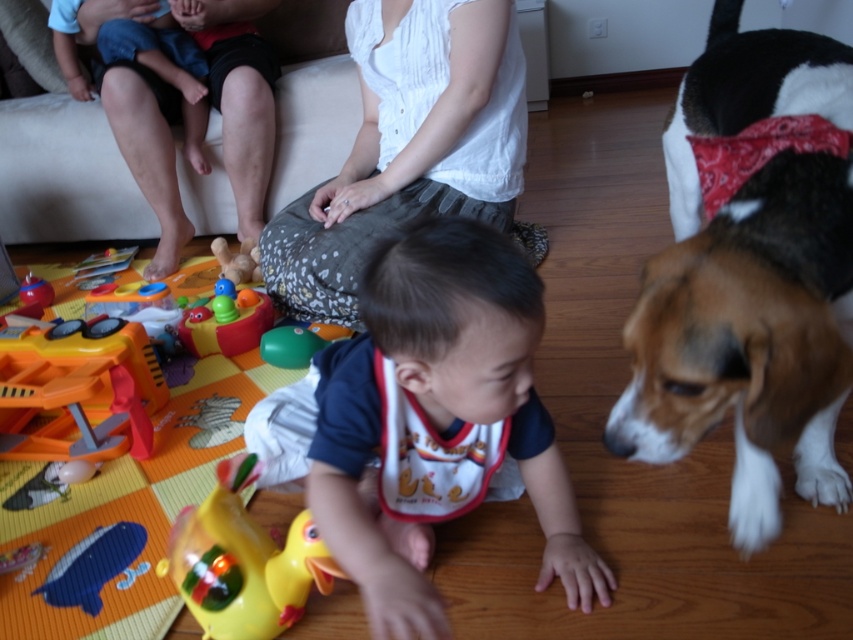
Can you confirm if yellow rubber duck at lower center is positioned above rubber/plastic toy at center?

Incorrect, yellow rubber duck at lower center is not positioned above rubber/plastic toy at center.

Is point (177, 563) farther from camera compared to point (206, 337)?

No, it is in front of (206, 337).

At what (x,y) coordinates should I click in order to perform the action: click on yellow rubber duck at lower center. Please return your answer as a coordinate pair (x, y). The image size is (853, 640). Looking at the image, I should click on (242, 561).

Can you confirm if yellow rubber duck at center is smaller than orange plastic toy at lower left?

Actually, yellow rubber duck at center might be larger than orange plastic toy at lower left.

In the scene shown: Who is positioned more to the left, yellow rubber duck at center or orange plastic toy at lower left?

orange plastic toy at lower left

Is point (585, 570) positioned in front of point (64, 442)?

Yes, it is in front of point (64, 442).

I want to click on yellow rubber duck at center, so click(x=438, y=419).

Which is below, white cotton shirt at upper center or rubber duck at center?

rubber duck at center

Which is more to the right, white cotton shirt at upper center or rubber duck at center?

Positioned to the right is white cotton shirt at upper center.

Which is in front, point (305, 250) or point (242, 241)?

Point (305, 250) is in front.

Locate an element on the screen. This screenshot has width=853, height=640. white cotton shirt at upper center is located at coordinates (407, 147).